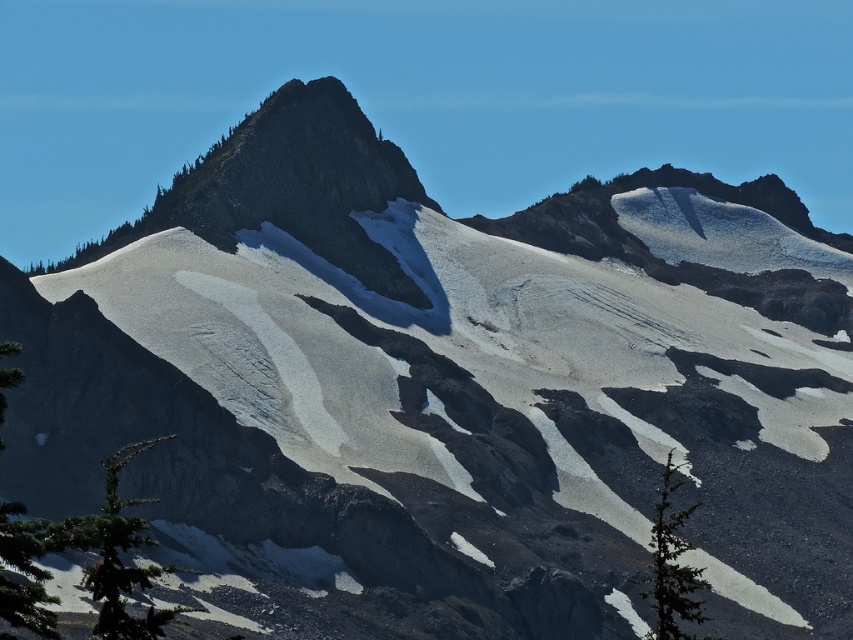
Who is more distant from viewer, (90,547) or (660,545)?

The point (660,545) is more distant.

The width and height of the screenshot is (853, 640). Describe the element at coordinates (119, 556) in the screenshot. I see `green textured pine tree at lower left` at that location.

The width and height of the screenshot is (853, 640). I want to click on green textured pine tree at lower left, so click(119, 556).